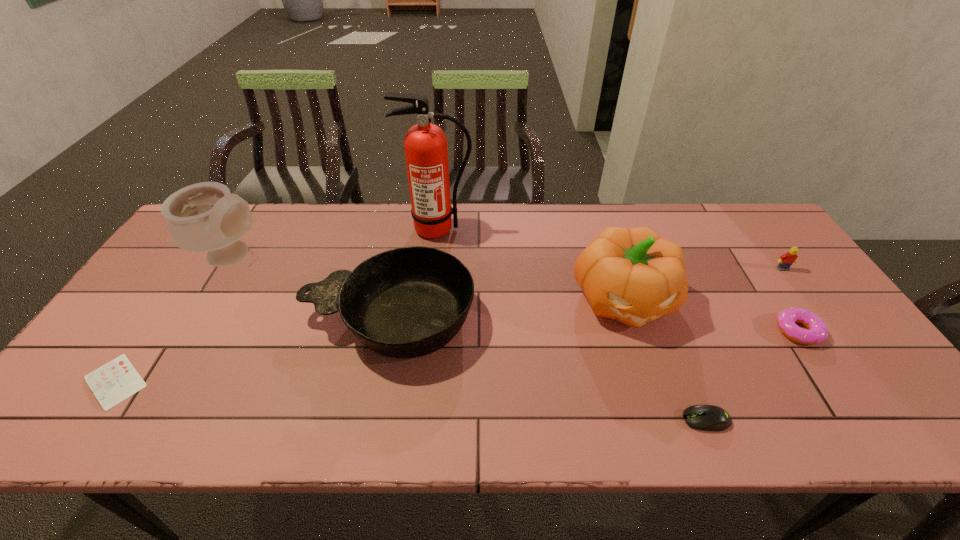
This screenshot has height=540, width=960. In order to click on vacant space at the far edge of the desktop in this screenshot , I will do `click(253, 222)`.

Locate an element on the screen. The width and height of the screenshot is (960, 540). free space at the near edge of the desktop is located at coordinates (757, 413).

The height and width of the screenshot is (540, 960). Find the location of `free space at the near left corner of the desktop`. free space at the near left corner of the desktop is located at coordinates (107, 416).

In the image, there is a desktop. Find the location of `vacant space at the near right corner`. vacant space at the near right corner is located at coordinates (857, 402).

Identify the location of free space between the fifth shortest object and the doughnut. The height and width of the screenshot is (540, 960). (593, 325).

I want to click on free space between the third shortest object and the third tallest object, so click(x=710, y=315).

Image resolution: width=960 pixels, height=540 pixels. What are the coordinates of `free space between the shortest object and the frying pan` in the screenshot? It's located at (252, 350).

This screenshot has height=540, width=960. I want to click on empty location between the second tallest object and the tallest object, so click(x=336, y=242).

Where is `free space that is in between the computer mouse and the Lego`? free space that is in between the computer mouse and the Lego is located at coordinates (744, 344).

Find the location of a particular element. This screenshot has height=540, width=960. vacant space in between the fire extinguisher and the seventh tallest object is located at coordinates (572, 325).